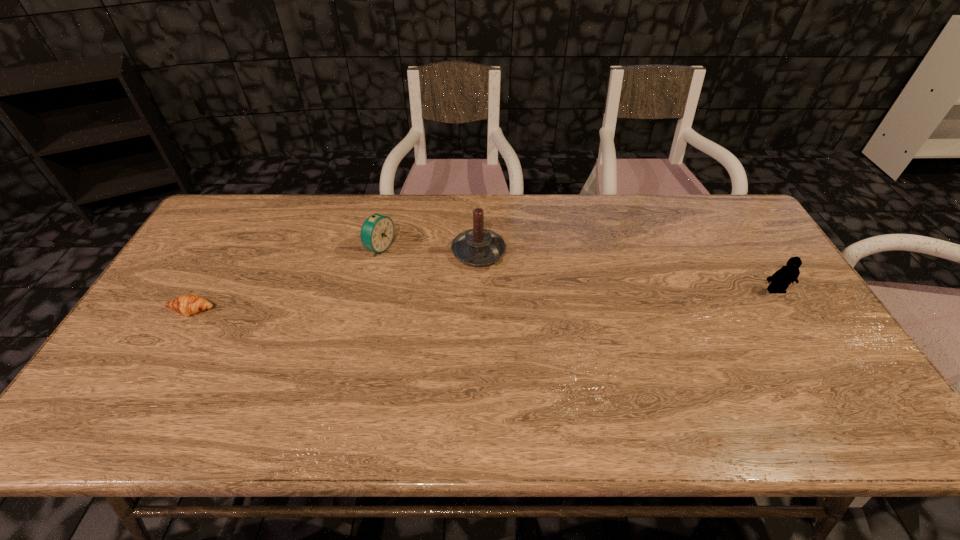
Identify the location of pastry. (189, 304).

Where is `the nearest object`? This screenshot has height=540, width=960. the nearest object is located at coordinates (189, 304).

Find the location of a particular element. This screenshot has width=960, height=540. the rightmost object is located at coordinates (780, 280).

Image resolution: width=960 pixels, height=540 pixels. Identify the location of the second nearest object. coord(780,280).

The width and height of the screenshot is (960, 540). Find the location of `candle`. candle is located at coordinates (476, 247).

Identify the location of the second object from right to left. This screenshot has height=540, width=960. (476, 247).

Locate an element on the screen. This screenshot has width=960, height=540. alarm clock is located at coordinates (377, 232).

Find the location of a particular element. The width and height of the screenshot is (960, 540). free region located on the front-facing side of the shortest object is located at coordinates 151,381.

I want to click on free spot located on the face of the rightmost object, so click(x=827, y=371).

Image resolution: width=960 pixels, height=540 pixels. In order to click on free location located on the side of the second object from right to left with the handle loop in this screenshot , I will do `click(573, 355)`.